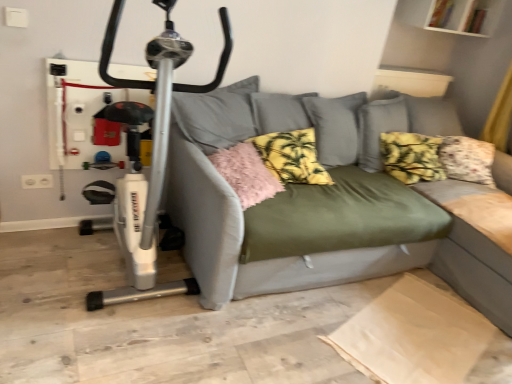
Question: Is white plastic exercise bike at left turned away from yellow floral cushion at center, which is counted as the third pillow, starting from the left?

Choices:
 (A) yes
 (B) no

Answer: (B)

Question: From the image's perspective, does white plastic exercise bike at left appear lower than yellow floral cushion at center, which is counted as the third pillow, starting from the left?

Choices:
 (A) yes
 (B) no

Answer: (A)

Question: Is white plastic exercise bike at left shorter than yellow floral cushion at center, which ranks as the first pillow in right-to-left order?

Choices:
 (A) yes
 (B) no

Answer: (B)

Question: Does white plastic exercise bike at left have a lesser width compared to yellow floral cushion at center, which is counted as the third pillow, starting from the left?

Choices:
 (A) yes
 (B) no

Answer: (B)

Question: Does white plastic exercise bike at left have a greater height compared to yellow floral cushion at center, which ranks as the first pillow in right-to-left order?

Choices:
 (A) yes
 (B) no

Answer: (A)

Question: Considering their positions, is pink fluffy pillow at center, which ranks as the first pillow in left-to-right order, located in front of or behind yellow printed fabric pillow at center, which ranks as the second pillow in right-to-left order?

Choices:
 (A) behind
 (B) front

Answer: (B)

Question: Considering the positions of point (226, 160) and point (313, 180), is point (226, 160) closer or farther from the camera than point (313, 180)?

Choices:
 (A) closer
 (B) farther

Answer: (A)

Question: In the image, is pink fluffy pillow at center, which ranks as the first pillow in left-to-right order, on the left side or the right side of yellow printed fabric pillow at center, which ranks as the second pillow in right-to-left order?

Choices:
 (A) left
 (B) right

Answer: (A)

Question: Is pink fluffy pillow at center, arranged as the 3th pillow when viewed from the right, wider or thinner than yellow printed fabric pillow at center, which appears as the second pillow when viewed from the left?

Choices:
 (A) wide
 (B) thin

Answer: (A)

Question: Considering the positions of olive green fabric couch at center and yellow printed fabric pillow at center, which ranks as the second pillow in right-to-left order, in the image, is olive green fabric couch at center wider or thinner than yellow printed fabric pillow at center, which ranks as the second pillow in right-to-left order,?

Choices:
 (A) thin
 (B) wide

Answer: (B)

Question: Is olive green fabric couch at center bigger or smaller than yellow printed fabric pillow at center, which ranks as the second pillow in right-to-left order?

Choices:
 (A) small
 (B) big

Answer: (B)

Question: From a real-world perspective, is olive green fabric couch at center physically located above or below yellow printed fabric pillow at center, which ranks as the second pillow in right-to-left order?

Choices:
 (A) above
 (B) below

Answer: (B)

Question: From the image's perspective, is olive green fabric couch at center above or below yellow printed fabric pillow at center, which ranks as the second pillow in right-to-left order?

Choices:
 (A) above
 (B) below

Answer: (B)

Question: From the image's perspective, is olive green fabric couch at center positioned above or below pink fluffy pillow at center, arranged as the 3th pillow when viewed from the right?

Choices:
 (A) below
 (B) above

Answer: (A)

Question: In terms of height, does olive green fabric couch at center look taller or shorter compared to pink fluffy pillow at center, which ranks as the first pillow in left-to-right order?

Choices:
 (A) tall
 (B) short

Answer: (A)